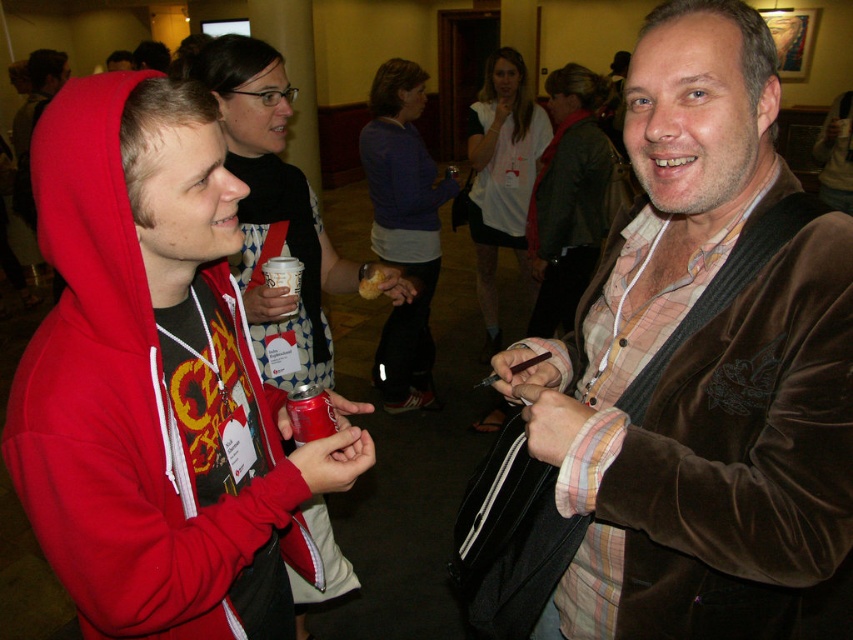
Which is behind, point (775, 508) or point (306, 388)?

The point (306, 388) is more distant.

In the scene shown: Does velvet brown jacket at center have a lesser width compared to metallic can at center?

No.

Who is more distant from viewer, [758,20] or [323,410]?

Positioned behind is point [323,410].

You are a GUI agent. You are given a task and a screenshot of the screen. Output one action in this format:
    pyautogui.click(x=<x>, y=<y>)
    Task: Click on the velvet brown jacket at center
    This screenshot has height=640, width=853.
    Given the screenshot: What is the action you would take?
    pyautogui.click(x=699, y=365)

Is metallic can at center in front of white paper cup at center?

Yes, it is.

Who is lower down, metallic can at center or white paper cup at center?

metallic can at center

Does point (286, 396) come in front of point (285, 264)?

Yes.

The width and height of the screenshot is (853, 640). I want to click on metallic can at center, so click(309, 413).

Is velvet brown jacket at center bigger than white paper cup at center?

Indeed, velvet brown jacket at center has a larger size compared to white paper cup at center.

Does velvet brown jacket at center lie behind white paper cup at center?

No, it is in front of white paper cup at center.

What are the coordinates of `velvet brown jacket at center` in the screenshot? It's located at (699, 365).

This screenshot has width=853, height=640. I want to click on velvet brown jacket at center, so click(x=699, y=365).